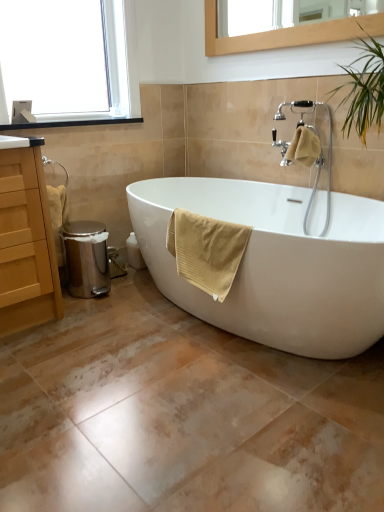
Locate an element on the screen. This screenshot has height=512, width=384. empty space that is to the right of matte wood cabinet at left is located at coordinates (87, 318).